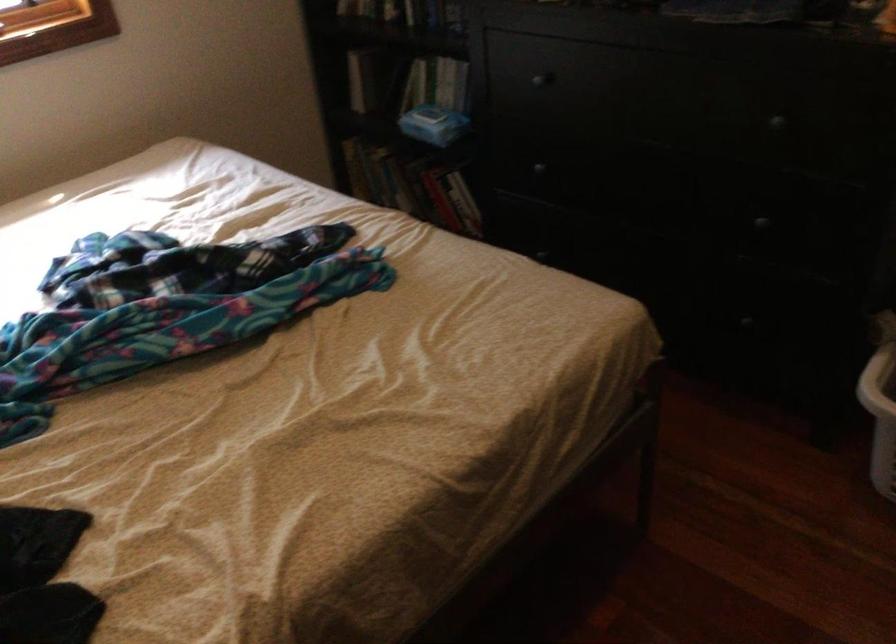
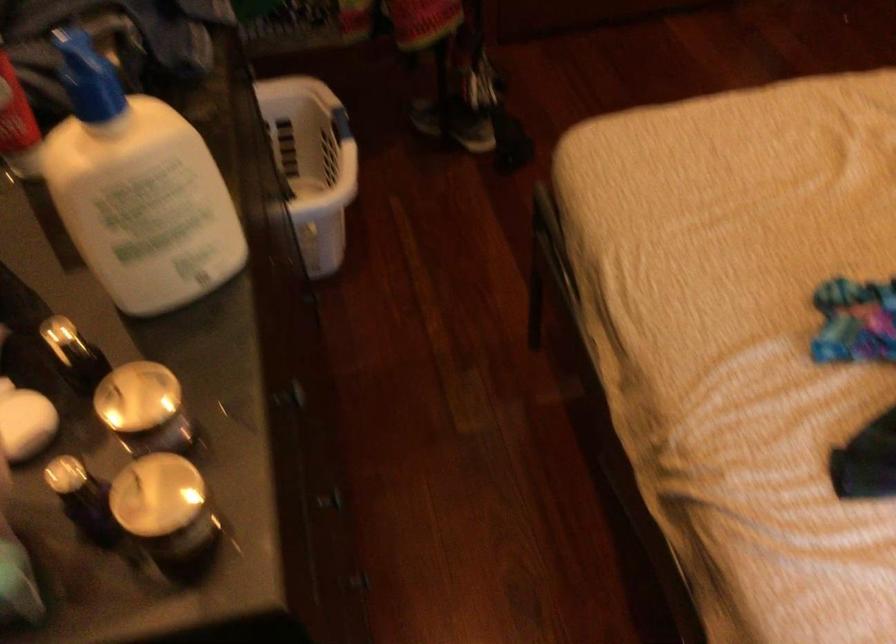
Find the pixel in the second image that matches pixel 553 257 in the first image.

(359, 582)